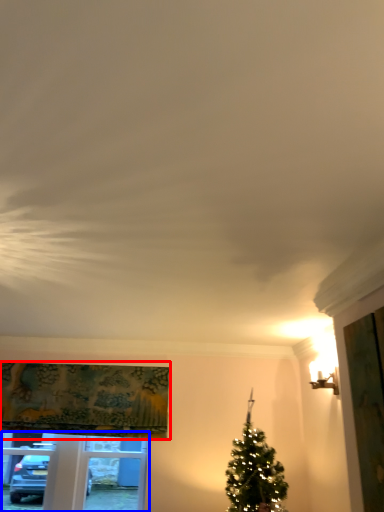
Question: Which point is closer to the camera, curtain (highlighted by a red box) or window frame (highlighted by a blue box)?

Choices:
 (A) curtain
 (B) window frame

Answer: (A)